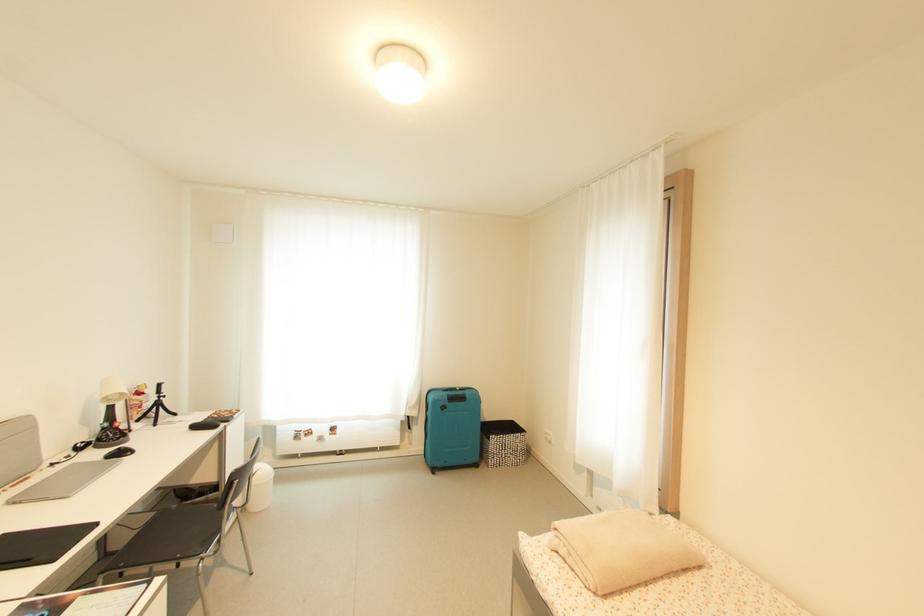
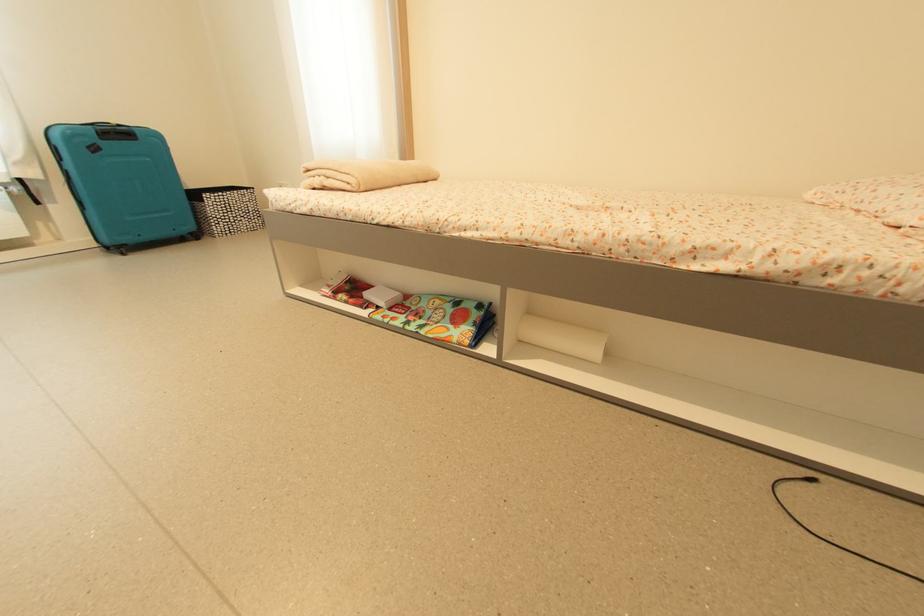
Find the pixel in the second image that matches (x=495, y=448) in the first image.

(213, 212)